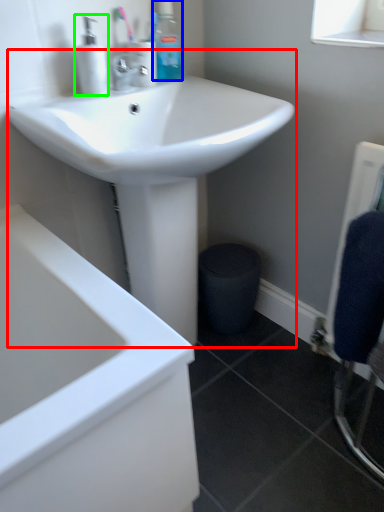
Question: Considering the real-world distances, which object is closest to sink (highlighted by a red box)? toiletry (highlighted by a blue box) or soap dispenser (highlighted by a green box).

Choices:
 (A) toiletry
 (B) soap dispenser

Answer: (B)